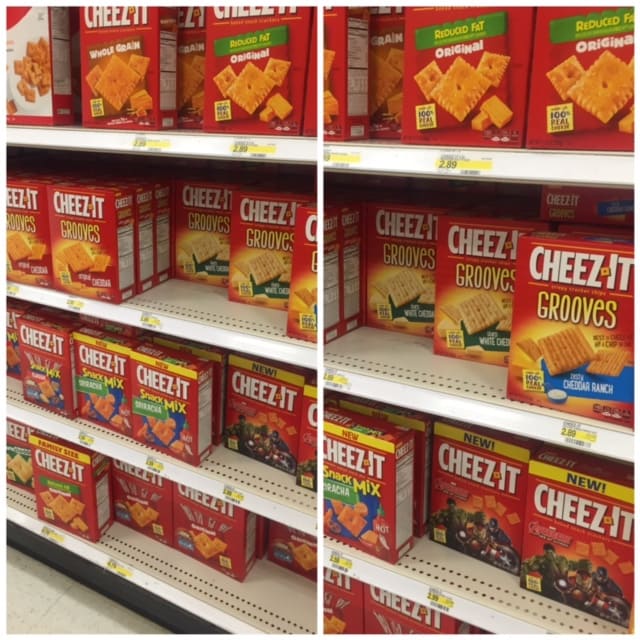
You are a GUI agent. You are given a task and a screenshot of the screen. Output one action in this format:
    pyautogui.click(x=<x>, y=<y>)
    Task: Click on the boxes on the bottom shelf
    
    Given the screenshot: What is the action you would take?
    pyautogui.click(x=61, y=486), pyautogui.click(x=11, y=456), pyautogui.click(x=140, y=496), pyautogui.click(x=201, y=532), pyautogui.click(x=288, y=555)